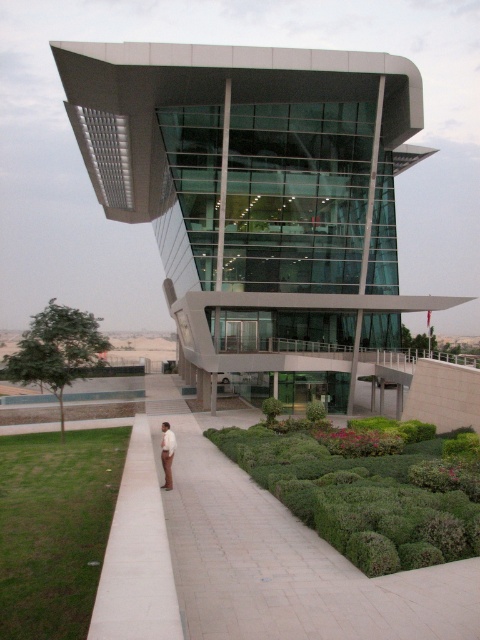
Question: Which point is farther from the camera taking this photo?

Choices:
 (A) (163, 458)
 (B) (156, 186)

Answer: (B)

Question: Is glassy modern building at center to the right of green bushy hedge at lower center from the viewer's perspective?

Choices:
 (A) no
 (B) yes

Answer: (A)

Question: Which object is closer to the camera taking this photo?

Choices:
 (A) white smooth shirt at center
 (B) green bushy hedge at lower center

Answer: (B)

Question: Does glassy modern building at center have a smaller size compared to green bushy hedge at lower center?

Choices:
 (A) yes
 (B) no

Answer: (B)

Question: Considering the relative positions of glassy modern building at center and white smooth shirt at center in the image provided, where is glassy modern building at center located with respect to white smooth shirt at center?

Choices:
 (A) below
 (B) above

Answer: (B)

Question: Which point is farther to the camera?

Choices:
 (A) green bushy hedge at lower center
 (B) white smooth shirt at center

Answer: (B)